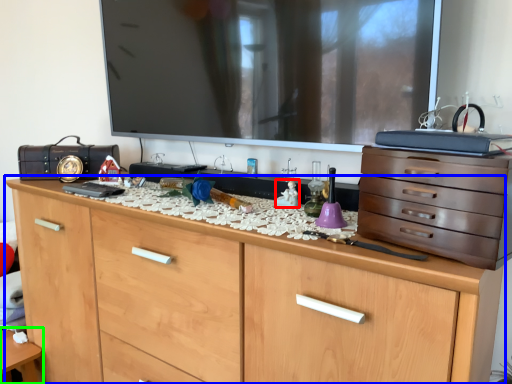
Question: Estimate the real-world distances between objects in this image. Which object is closer to toy (highlighted by a red box), chest of drawers (highlighted by a blue box) or table (highlighted by a green box)?

Choices:
 (A) chest of drawers
 (B) table

Answer: (A)